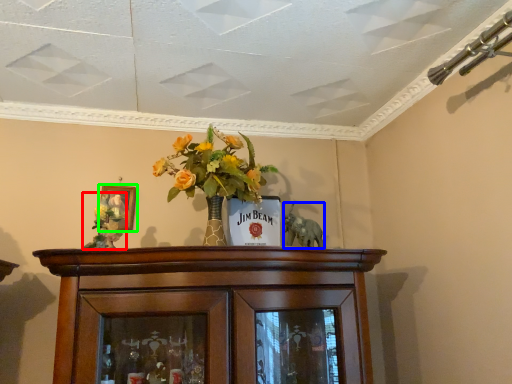
Question: Based on their relative distances, which object is farther from floral arrangement (highlighted by a red box)? Choose from animal (highlighted by a blue box) and picture frame (highlighted by a green box).

Choices:
 (A) animal
 (B) picture frame

Answer: (A)